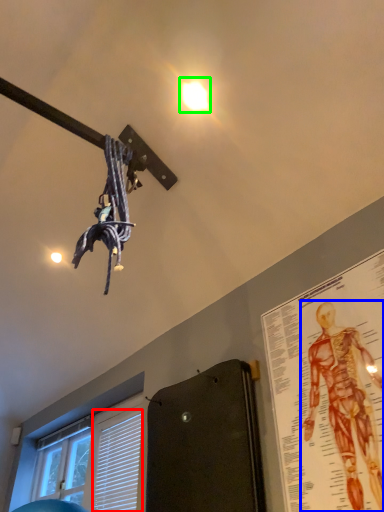
Question: Which object is the farthest from blind (highlighted by a red box)? Choose among these: person (highlighted by a blue box) or droplight (highlighted by a green box).

Choices:
 (A) person
 (B) droplight

Answer: (B)